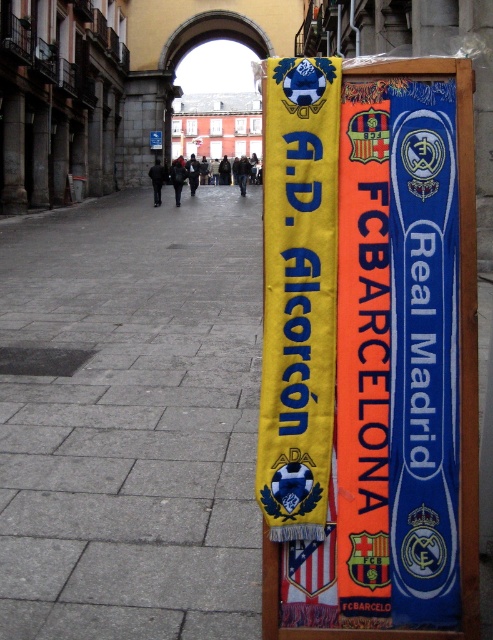
Question: Which of the following is the closest to the observer?

Choices:
 (A) (232, 316)
 (B) (373, 580)

Answer: (B)

Question: Does gray stone pavement at center lie in front of yellow fabric banner at center?

Choices:
 (A) no
 (B) yes

Answer: (A)

Question: Considering the relative positions of gray stone pavement at center and yellow fabric banner at center in the image provided, where is gray stone pavement at center located with respect to yellow fabric banner at center?

Choices:
 (A) left
 (B) right

Answer: (A)

Question: Is gray stone pavement at center above yellow fabric banner at center?

Choices:
 (A) no
 (B) yes

Answer: (B)